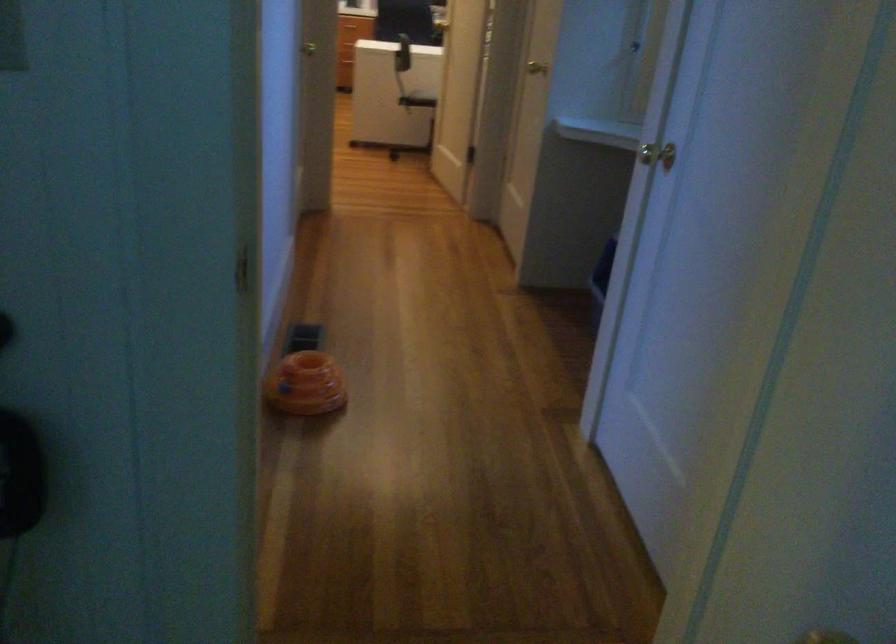
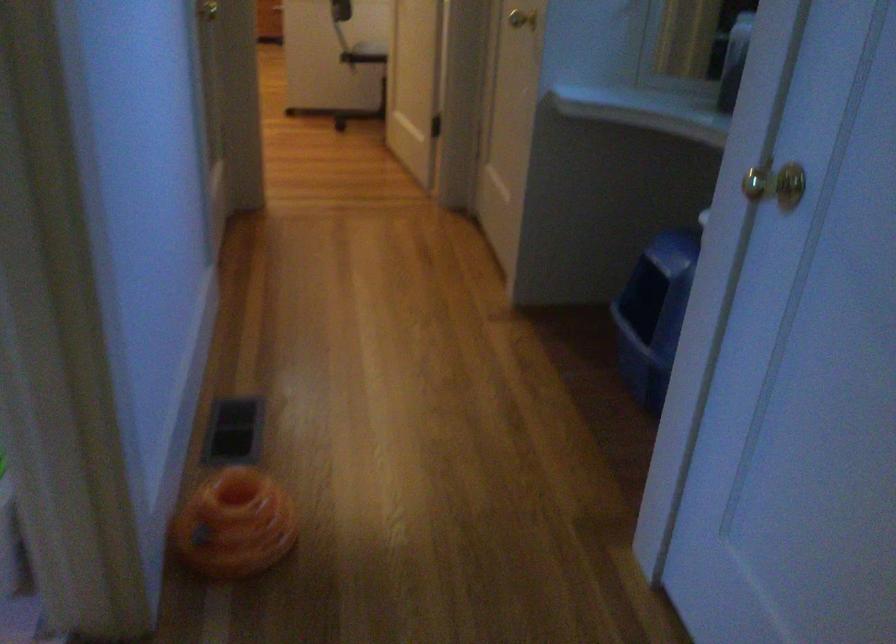
Question: The images are taken continuously from a first-person perspective. In which direction is your viewpoint rotating?

Choices:
 (A) Left
 (B) Right
 (C) Up
 (D) Down

Answer: (D)